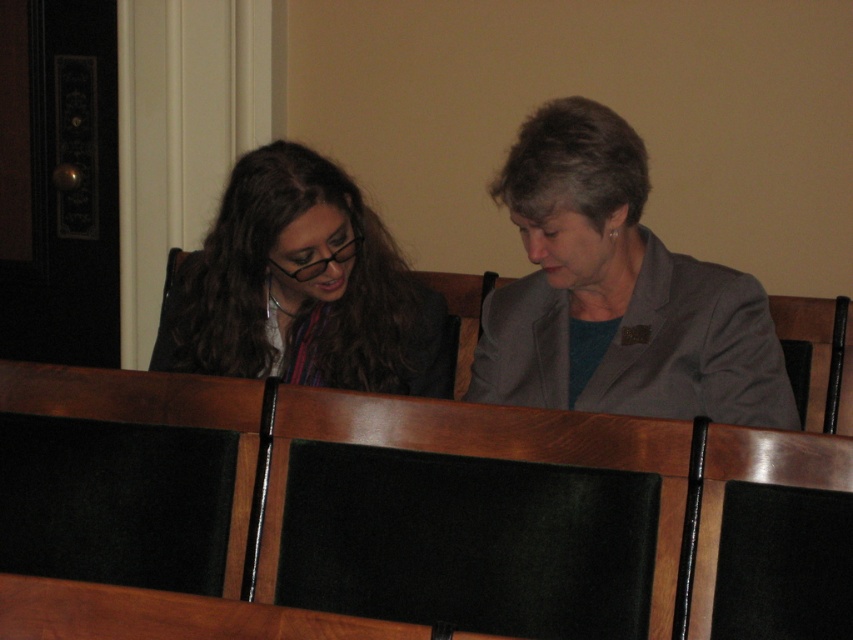
Who is positioned more to the left, wooden table at center or black leather chair at center?

wooden table at center is more to the left.

Does point (138, 604) lie behind point (454, 374)?

No, (138, 604) is closer to viewer.

Which is in front, point (70, 580) or point (440, 326)?

Point (70, 580) is more forward.

Locate an element on the screen. The width and height of the screenshot is (853, 640). wooden table at center is located at coordinates (167, 616).

Between gray fabric jacket at center and matte black hair at left, which one has more height?

Standing taller between the two is gray fabric jacket at center.

Is gray fabric jacket at center shorter than matte black hair at left?

In fact, gray fabric jacket at center may be taller than matte black hair at left.

The image size is (853, 640). Find the location of `gray fabric jacket at center`. gray fabric jacket at center is located at coordinates (616, 292).

Where is `gray fabric jacket at center`? The height and width of the screenshot is (640, 853). gray fabric jacket at center is located at coordinates (616, 292).

From the picture: Can you confirm if black fabric chair at center is positioned below matte black hair at left?

Correct, black fabric chair at center is located below matte black hair at left.

Can you confirm if black fabric chair at center is bigger than matte black hair at left?

No.

Is point (585, 544) positioned before point (318, 374)?

Yes, it is in front of point (318, 374).

Find the location of `black fabric chair at center`. black fabric chair at center is located at coordinates (471, 515).